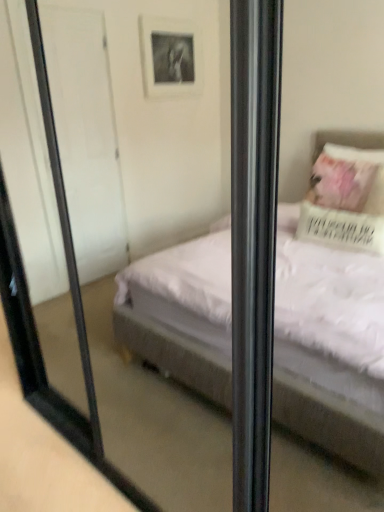
Image resolution: width=384 pixels, height=512 pixels. What are the coordinates of `free area below transparent glass door at center (from a real-world perspective)` in the screenshot? It's located at (149, 435).